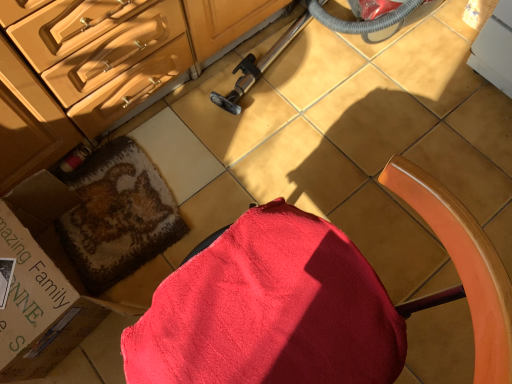
Question: Is red fabric chair at center in front of or behind cardboard box at lower left in the image?

Choices:
 (A) front
 (B) behind

Answer: (A)

Question: Considering the positions of point (449, 233) and point (141, 178), is point (449, 233) closer or farther from the camera than point (141, 178)?

Choices:
 (A) farther
 (B) closer

Answer: (B)

Question: Based on their relative distances, which object is nearer to the red cotton bath towel at lower left?

Choices:
 (A) cardboard box at lower left
 (B) red fabric chair at center
 (C) matte wood cabinetry at upper left

Answer: (A)

Question: Which is nearer to the red fabric chair at center?

Choices:
 (A) matte wood cabinetry at upper left
 (B) cardboard box at lower left
 (C) red cotton bath towel at lower left

Answer: (B)